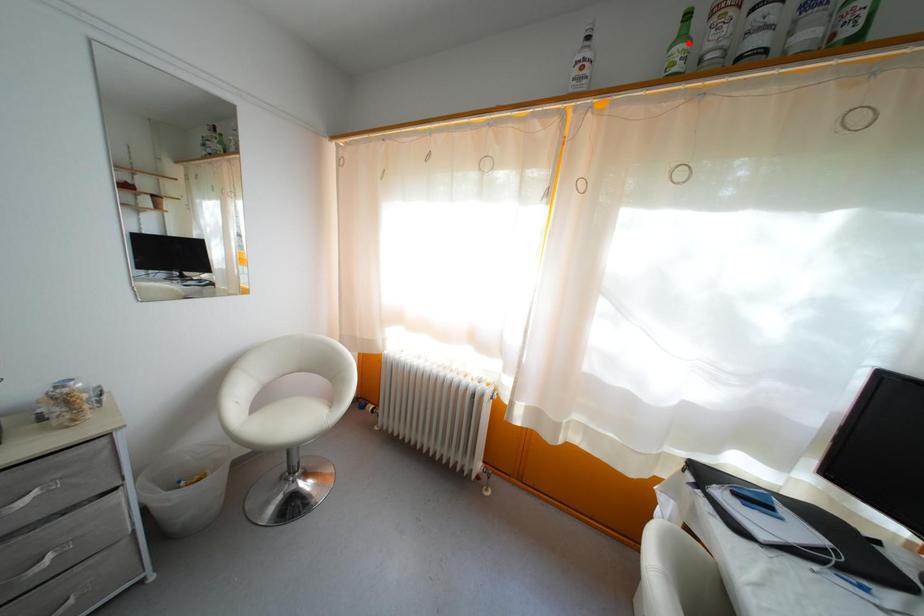
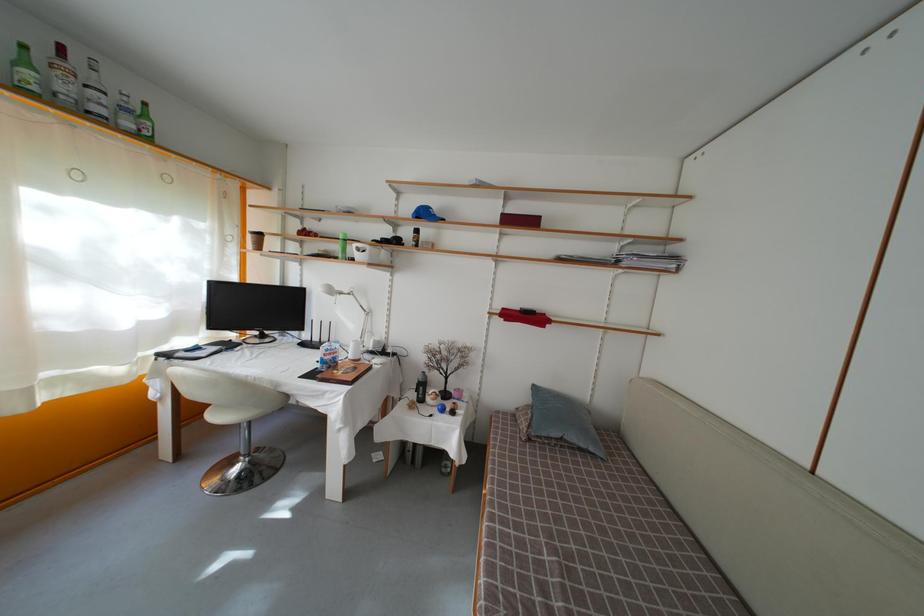
Find the pixel in the second image that matches the highlighted location in the first image.

(31, 69)